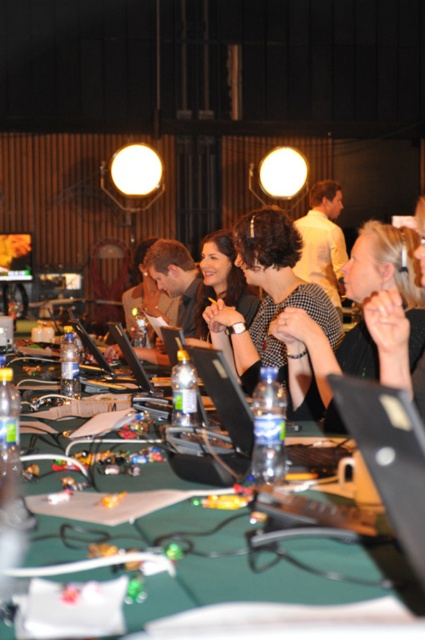
At what (x,y) coordinates should I click in order to perform the action: click on matte black shirt at center. Please return your answer as a coordinate pair (x, y). The image size is (425, 640). Looking at the image, I should click on (268, 296).

Can you confirm if matte black shirt at center is positioned above matte black laptop at center?

Indeed, matte black shirt at center is positioned over matte black laptop at center.

Locate an element on the screen. The width and height of the screenshot is (425, 640). matte black shirt at center is located at coordinates (268, 296).

Does point (221, 346) lie behind point (129, 352)?

Yes, point (221, 346) is behind point (129, 352).

Identify the location of matte black shirt at center. (268, 296).

Who is more forward, (333, 326) or (124, 330)?

Point (333, 326)

In order to click on matte black shirt at center in this screenshot , I will do `click(268, 296)`.

Does black textured shirt at center have a smaller size compared to matte black laptop at center?

No.

Where is `black textured shirt at center`? This screenshot has height=640, width=425. black textured shirt at center is located at coordinates (322, 364).

At what (x,y) coordinates should I click in order to perform the action: click on black textured shirt at center. Please return your answer as a coordinate pair (x, y). This screenshot has width=425, height=640. Looking at the image, I should click on (322, 364).